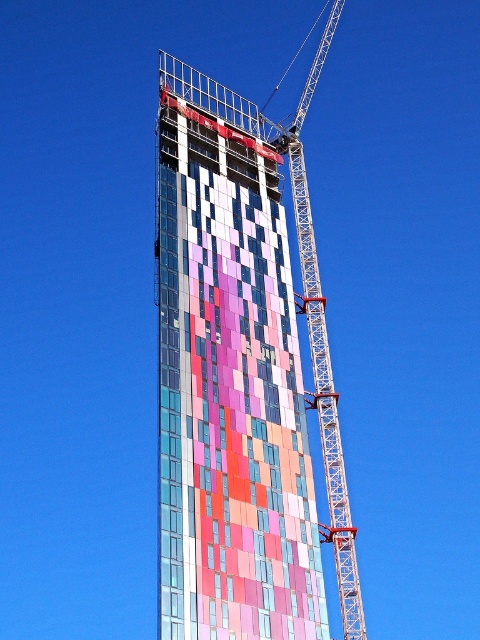
Who is shorter, multicolored glass facade at center or metallic lattice crane at center?

multicolored glass facade at center

What do you see at coordinates (228, 378) in the screenshot? Image resolution: width=480 pixels, height=640 pixels. I see `multicolored glass facade at center` at bounding box center [228, 378].

You are a GUI agent. You are given a task and a screenshot of the screen. Output one action in this format:
    pyautogui.click(x=<x>, y=<y>)
    Task: Click on the multicolored glass facade at center
    
    Given the screenshot: What is the action you would take?
    pyautogui.click(x=228, y=378)

Find the location of a particular element. multicolored glass facade at center is located at coordinates (228, 378).